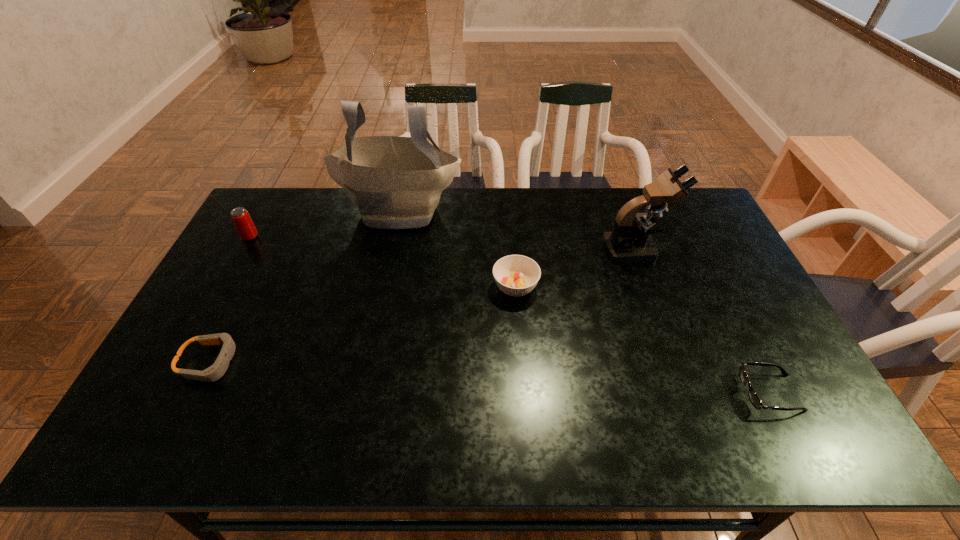
Find the location of a particular element. Image resolution: width=960 pixels, height=540 pixels. free location located on the back of the microscope is located at coordinates (621, 211).

Find the location of `vacant space situated on the front of the beer can`. vacant space situated on the front of the beer can is located at coordinates (208, 311).

Find the location of a particular element. free space located 0.210m on the left of the third object from right to left is located at coordinates (422, 287).

Locate an element on the screen. blank space located on the lenses of the rightmost object is located at coordinates (713, 393).

Identify the location of free space located 0.220m on the lenses of the rightmost object. (652, 393).

Where is `vacant space located on the lenses of the rightmost object`? vacant space located on the lenses of the rightmost object is located at coordinates (595, 393).

Identify the location of free spot located on the front and back of the goggles. Image resolution: width=960 pixels, height=540 pixels. (347, 362).

The image size is (960, 540). I want to click on object located in the far edge section of the desktop, so click(396, 182).

This screenshot has height=540, width=960. I want to click on object located in the near edge section of the desktop, so click(754, 399).

Find the location of `beer can at the left edge`. beer can at the left edge is located at coordinates (240, 216).